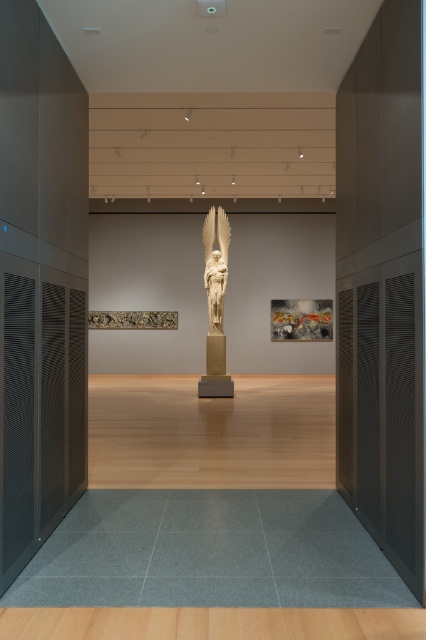
Question: Can you confirm if white marble statue at center is positioned to the right of gold textured sculpture at center?

Choices:
 (A) yes
 (B) no

Answer: (B)

Question: Is white marble statue at center in front of gold textured sculpture at center?

Choices:
 (A) no
 (B) yes

Answer: (B)

Question: Which object appears closest to the camera in this image?

Choices:
 (A) gold textured sculpture at center
 (B) white marble statue at center

Answer: (B)

Question: Which point appears farthest from the camera in this image?

Choices:
 (A) (210, 280)
 (B) (330, 321)

Answer: (B)

Question: Is white marble statue at center behind gold textured sculpture at center?

Choices:
 (A) no
 (B) yes

Answer: (A)